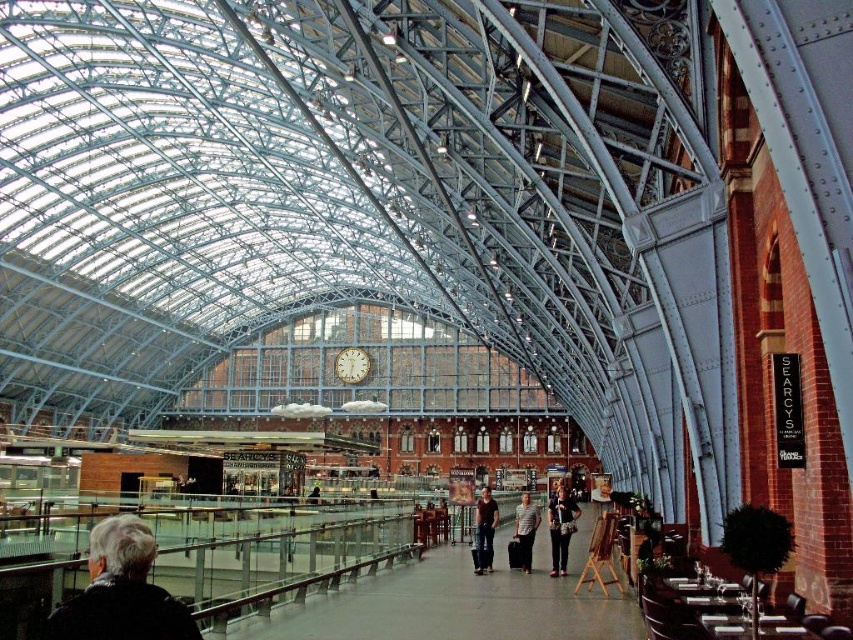
You are a traveler standing at the entrance of the grand railway station. You see a matte black jacket at center and a gold textured clock at center. How far apart are these two items from each other?

The distance between the matte black jacket at center and the gold textured clock at center is 148.71 feet.

You are standing in the center of the grand railway station and see two points marked on the floor. The first point is labeled as point (148, 541) and the second is point (525, 502). From your current position, which point is closer to you?

Point (148, 541) is in front of point (525, 502), so it is closer to you.

You are a traveler standing at the entrance of the station and notice two people wearing the matte black jacket at center and the striped shirt at center. Which clothing item is taller?

The matte black jacket at center is taller than the striped shirt at center.